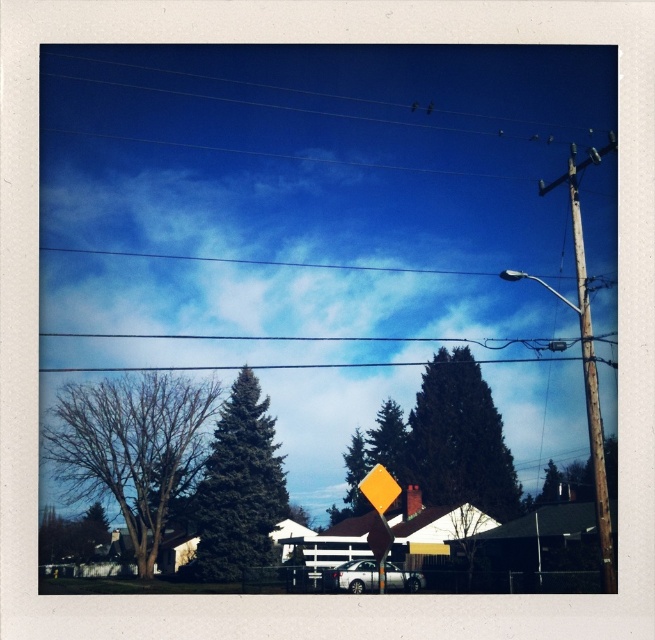
You are a bird looking for a nesting spot. You see the bare branches at left and the green matte evergreen tree at center. Which tree would provide a larger nesting area?

The bare branches at left has a larger size compared to the green matte evergreen tree at center, so it would provide a larger nesting area.

You are a photographer wanting to capture the weathered wood telegraph pole at right and the green matte evergreen tree at center in the same frame. Based on their positions, which object would appear closer to you in the photograph?

The green matte evergreen tree at center appears closer to you because the weathered wood telegraph pole at right is positioned behind it.

Based on the scene, which tree is taller? The bare branches at left or the green matte evergreen tree at center?

The green matte evergreen tree at center is taller than the bare branches at left.